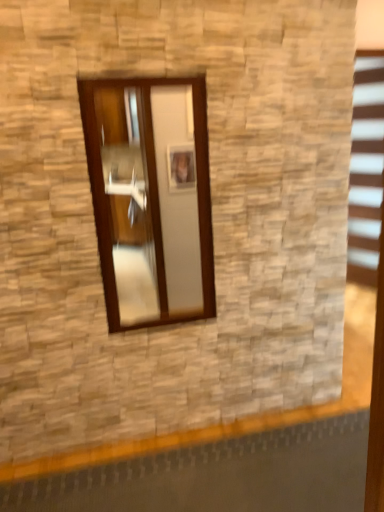
You are a GUI agent. You are given a task and a screenshot of the screen. Output one action in this format:
    pyautogui.click(x=<x>, y=<y>)
    Task: Click on the vacant point above wooden-framed mirror at center (from a real-world perspective)
    This screenshot has height=512, width=384.
    Given the screenshot: What is the action you would take?
    click(x=144, y=71)